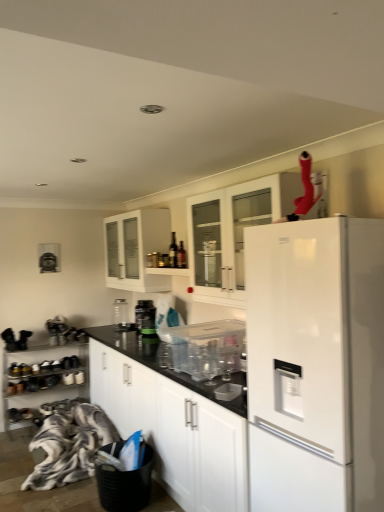
Question: Which direction should I rotate to look at clear glass jar at center, which is the 1th appliance in left-to-right order, — up or down?

Choices:
 (A) down
 (B) up

Answer: (A)

Question: Is dark brown glass wine bottle at upper center positioned with its back to metallic silver shoe rack at lower left, the fourth cabinetry when ordered from top to bottom?

Choices:
 (A) yes
 (B) no

Answer: (B)

Question: From the image's perspective, is dark brown glass wine bottle at upper center located beneath metallic silver shoe rack at lower left, the 1th cabinetry when ordered from bottom to top?

Choices:
 (A) yes
 (B) no

Answer: (B)

Question: Is dark brown glass wine bottle at upper center oriented towards metallic silver shoe rack at lower left, the fourth cabinetry when ordered from top to bottom?

Choices:
 (A) no
 (B) yes

Answer: (A)

Question: Considering the relative sizes of dark brown glass wine bottle at upper center and metallic silver shoe rack at lower left, the 1th cabinetry when ordered from bottom to top, in the image provided, is dark brown glass wine bottle at upper center smaller than metallic silver shoe rack at lower left, the 1th cabinetry when ordered from bottom to top,?

Choices:
 (A) no
 (B) yes

Answer: (B)

Question: Is metallic silver shoe rack at lower left, the 1th cabinetry when ordered from bottom to top, a part of dark brown glass wine bottle at upper center?

Choices:
 (A) yes
 (B) no

Answer: (B)

Question: Does dark brown glass wine bottle at upper center appear on the left side of metallic silver shoe rack at lower left, the 1th cabinetry when ordered from bottom to top?

Choices:
 (A) yes
 (B) no

Answer: (B)

Question: Is green matte jar at center, the 2th appliance when ordered from left to right, far away from white glass cabinet at upper center, which ranks as the 3th cabinetry in bottom-to-top order?

Choices:
 (A) no
 (B) yes

Answer: (A)

Question: Is white glass cabinet at upper center, which ranks as the 3th cabinetry in bottom-to-top order, surrounded by green matte jar at center, which is the 2th appliance in front-to-back order?

Choices:
 (A) yes
 (B) no

Answer: (B)

Question: Can we say green matte jar at center, arranged as the second appliance when viewed from the right, lies outside white glass cabinet at upper center, which ranks as the 3th cabinetry in bottom-to-top order?

Choices:
 (A) yes
 (B) no

Answer: (A)

Question: Is green matte jar at center, which is the 2th appliance in front-to-back order, closer to the viewer compared to white glass cabinet at upper center, which ranks as the 3th cabinetry in bottom-to-top order?

Choices:
 (A) no
 (B) yes

Answer: (A)

Question: Is green matte jar at center, the 2th appliance when ordered from left to right, facing towards white glass cabinet at upper center, which ranks as the 3th cabinetry in bottom-to-top order?

Choices:
 (A) yes
 (B) no

Answer: (B)

Question: From the image's perspective, would you say green matte jar at center, the 2th appliance when ordered from back to front, is positioned over white glass cabinet at upper center, which ranks as the 3th cabinetry in bottom-to-top order?

Choices:
 (A) no
 (B) yes

Answer: (A)

Question: Does fluffy fabric blanket at lower left have a smaller size compared to metallic silver shoe rack at lower left, the 1th cabinetry when ordered from bottom to top?

Choices:
 (A) no
 (B) yes

Answer: (A)